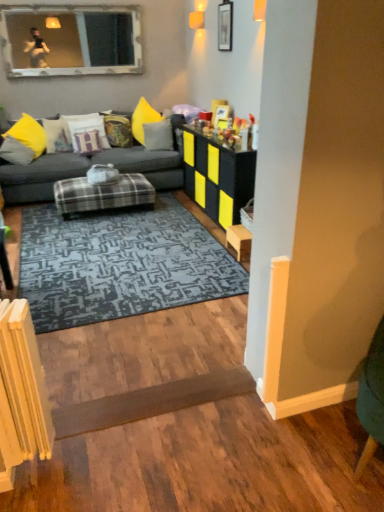
Question: Can you confirm if yellow fabric pillow at left, the 5th pillow from the right, is smaller than blue textured rug at center?

Choices:
 (A) no
 (B) yes

Answer: (B)

Question: Is yellow fabric pillow at left, the 5th pillow from the right, at the right side of blue textured rug at center?

Choices:
 (A) no
 (B) yes

Answer: (A)

Question: From a real-world perspective, is yellow fabric pillow at left, the 5th pillow from the right, located beneath blue textured rug at center?

Choices:
 (A) yes
 (B) no

Answer: (B)

Question: From the image's perspective, would you say yellow fabric pillow at left, the 5th pillow from the right, is shown under blue textured rug at center?

Choices:
 (A) yes
 (B) no

Answer: (B)

Question: From the image's perspective, is yellow fabric pillow at left, the 5th pillow from the right, over blue textured rug at center?

Choices:
 (A) yes
 (B) no

Answer: (A)

Question: In terms of size, does dark gray fabric couch at center appear bigger or smaller than blue textured rug at center?

Choices:
 (A) big
 (B) small

Answer: (A)

Question: Does point (114, 159) appear closer or farther from the camera than point (173, 278)?

Choices:
 (A) farther
 (B) closer

Answer: (A)

Question: Which is correct: dark gray fabric couch at center is inside blue textured rug at center, or outside of it?

Choices:
 (A) inside
 (B) outside

Answer: (B)

Question: Considering the positions of dark gray fabric couch at center and blue textured rug at center in the image, is dark gray fabric couch at center taller or shorter than blue textured rug at center?

Choices:
 (A) tall
 (B) short

Answer: (A)

Question: In terms of height, does blue textured rug at center look taller or shorter compared to dark brown wood plank at lower center?

Choices:
 (A) short
 (B) tall

Answer: (B)

Question: Based on their positions, is blue textured rug at center located to the left or right of dark brown wood plank at lower center?

Choices:
 (A) left
 (B) right

Answer: (A)

Question: Relative to dark brown wood plank at lower center, is blue textured rug at center in front or behind?

Choices:
 (A) behind
 (B) front

Answer: (A)

Question: Choose the correct answer: Is blue textured rug at center inside dark brown wood plank at lower center or outside it?

Choices:
 (A) inside
 (B) outside

Answer: (B)

Question: From a real-world perspective, relative to wooden picture frame at upper center, is velvet yellow pillow at center, positioned as the 2th pillow in right-to-left order, vertically above or below?

Choices:
 (A) above
 (B) below

Answer: (B)

Question: From the image's perspective, is velvet yellow pillow at center, arranged as the 4th pillow when viewed from the left, positioned above or below wooden picture frame at upper center?

Choices:
 (A) below
 (B) above

Answer: (A)